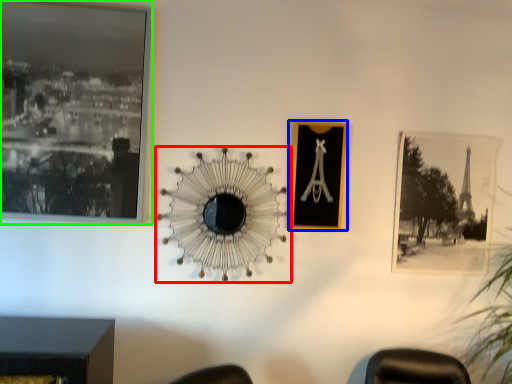
Question: Considering the real-world distances, which object is farthest from mirror (highlighted by a red box)? picture frame (highlighted by a blue box) or picture frame (highlighted by a green box)?

Choices:
 (A) picture frame
 (B) picture frame

Answer: (B)